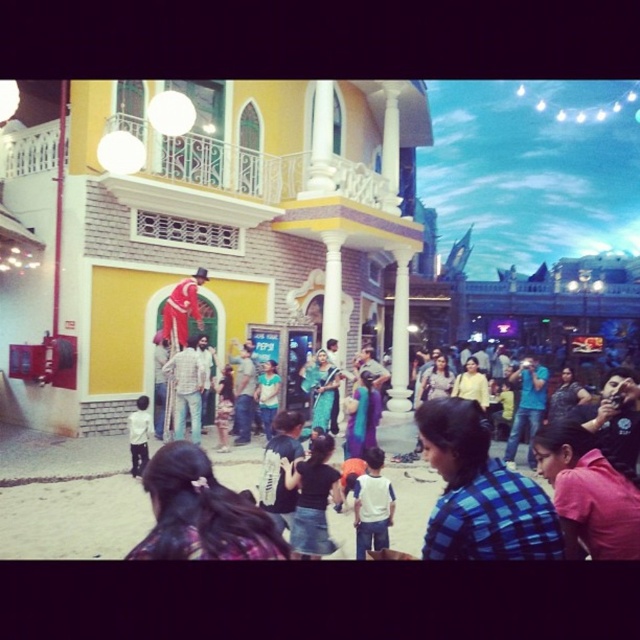
Question: Which point is closer to the camera taking this photo?

Choices:
 (A) (182, 387)
 (B) (388, 488)

Answer: (B)

Question: Does matte black shirt at center have a lesser width compared to blue plaid shirt at lower right?

Choices:
 (A) yes
 (B) no

Answer: (B)

Question: Which is nearer to the matte black shirt at center?

Choices:
 (A) blue checkered shirt at center
 (B) dark blue denim jeans at center

Answer: (A)

Question: Where is yellow matte building at center located in relation to blue checkered shirt at center in the image?

Choices:
 (A) below
 (B) above

Answer: (B)

Question: Considering the relative positions of yellow matte building at center and red velvet clown at center in the image provided, where is yellow matte building at center located with respect to red velvet clown at center?

Choices:
 (A) left
 (B) right

Answer: (B)

Question: Which of the following is the closest to the observer?

Choices:
 (A) (376, 520)
 (B) (204, 241)

Answer: (A)